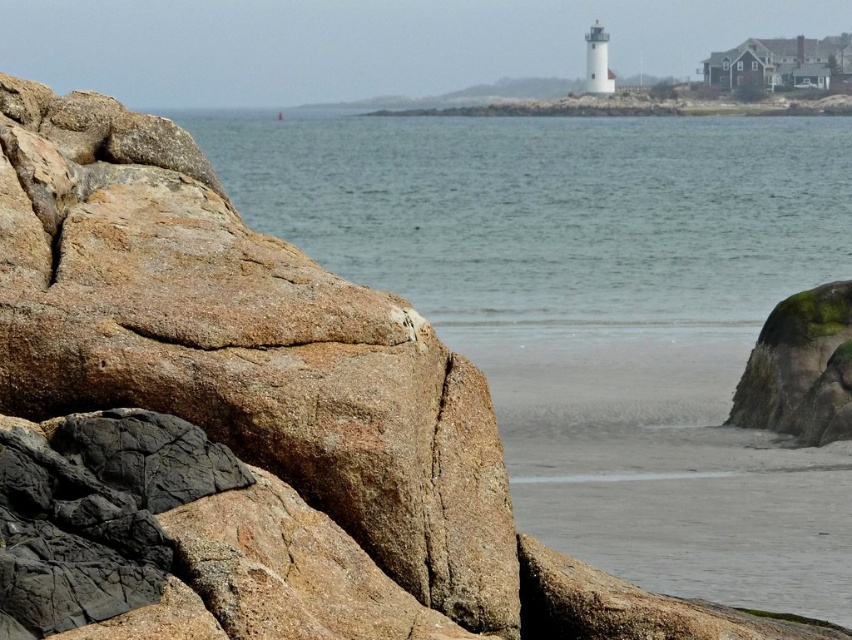
You are a hiker who needs to cross from the brown rough rock at left to the clear water at center. Given that your maximum jumping distance is 100 meters, can you safely make the jump?

The brown rough rock at left and clear water at center are 112.85 meters apart from each other, so the distance is greater than your maximum jumping distance of 100 meters. Therefore, you cannot safely make the jump.

Looking at this image, you are standing on the beach and see the clear water at center and the green mossy rock at lower right. Which object is closer to the horizon?

The clear water at center is above the green mossy rock at lower right, meaning it is closer to the horizon.

Looking at this image, you are standing on the sandy beach in the middle ground of the coastal scene. You see a point marked at coordinates [242,346]. What object is located at that point?

The point at coordinates [242,346] indicates a brown rough rock at the left.